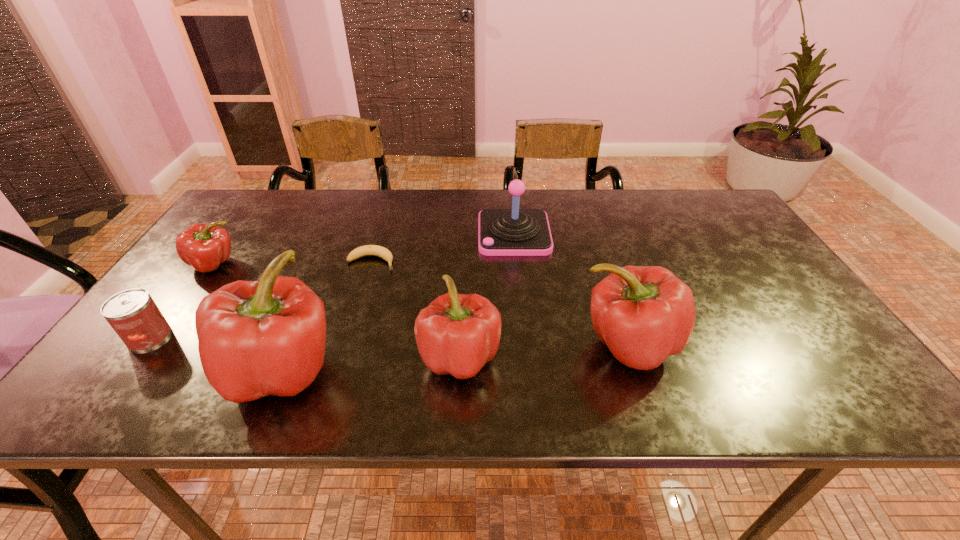
Where is `can located in the left edge section of the desktop`? This screenshot has width=960, height=540. can located in the left edge section of the desktop is located at coordinates (133, 314).

This screenshot has height=540, width=960. In order to click on object located in the near left corner section of the desktop in this screenshot , I will do `click(133, 314)`.

Locate an element on the screen. The width and height of the screenshot is (960, 540). vacant space at the far edge of the desktop is located at coordinates (414, 215).

In order to click on vacant space at the left edge in this screenshot , I will do `click(178, 278)`.

Where is `vacant space at the right edge`? vacant space at the right edge is located at coordinates (784, 287).

In order to click on free location at the far left corner of the desktop in this screenshot , I will do `click(252, 214)`.

What are the coordinates of `vacant region between the pepper and the rightmost bell pepper` in the screenshot? It's located at [421, 305].

Locate an element on the screen. The width and height of the screenshot is (960, 540). vacant area between the pepper and the can is located at coordinates (181, 300).

Locate an element on the screen. The image size is (960, 540). free spot between the pepper and the second bell pepper from right to left is located at coordinates (337, 310).

This screenshot has height=540, width=960. Find the location of `vacant area between the shortest bell pepper and the leftmost bell pepper`. vacant area between the shortest bell pepper and the leftmost bell pepper is located at coordinates (371, 363).